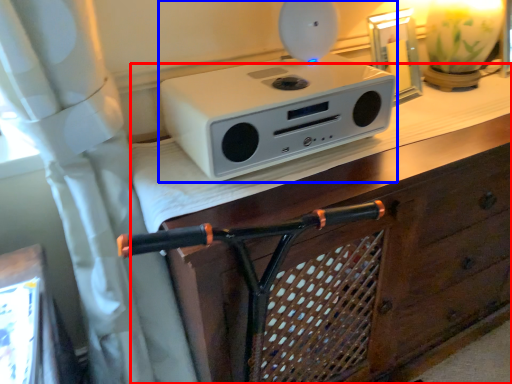
Question: Which object appears farthest to the camera in this image, vanity (highlighted by a red box) or home appliance (highlighted by a blue box)?

Choices:
 (A) vanity
 (B) home appliance

Answer: (B)